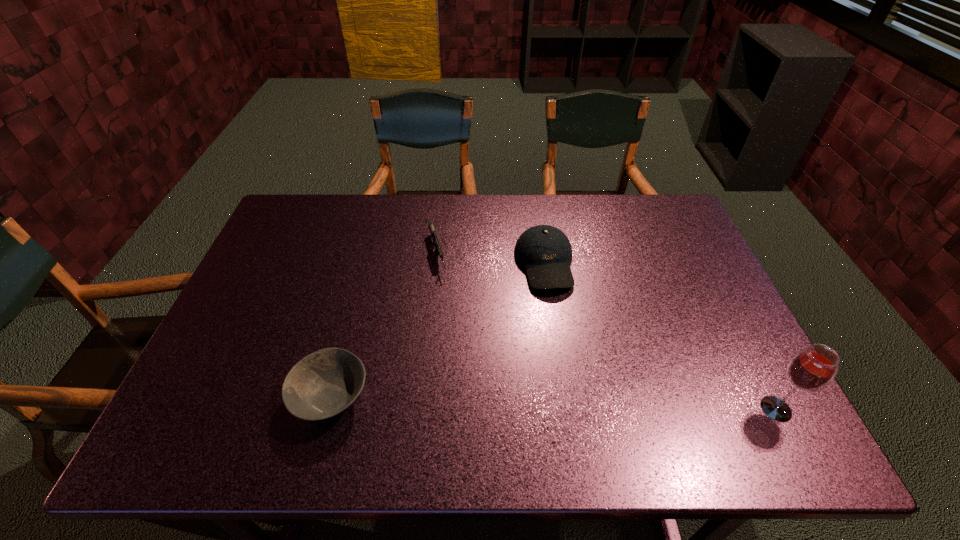
The image size is (960, 540). In order to click on vacant area in the image that satisfies the following two spatial constraints: 1. on the back side of the third object from left to right; 2. on the left side of the leftmost object in this screenshot , I will do pyautogui.click(x=366, y=264).

Find the location of `free point that satisfies the following two spatial constraints: 1. on the back side of the bowl; 2. on the left side of the second tallest object`. free point that satisfies the following two spatial constraints: 1. on the back side of the bowl; 2. on the left side of the second tallest object is located at coordinates (366, 264).

Where is `free spot that satisfies the following two spatial constraints: 1. on the front side of the tallest object; 2. on the left side of the gun`? free spot that satisfies the following two spatial constraints: 1. on the front side of the tallest object; 2. on the left side of the gun is located at coordinates (422, 409).